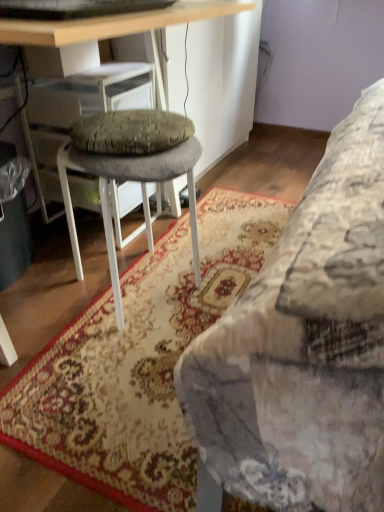
Question: In the image, is floral carpet at lower right positioned in front of or behind gray fabric stool at center?

Choices:
 (A) front
 (B) behind

Answer: (A)

Question: Is floral carpet at lower right spatially inside gray fabric stool at center, or outside of it?

Choices:
 (A) inside
 (B) outside

Answer: (B)

Question: Which object is the closest to the wooden desk at center?

Choices:
 (A) floral carpet at lower right
 (B) gray fabric stool at center

Answer: (B)

Question: Which object is the closest to the wooden desk at center?

Choices:
 (A) gray fabric stool at center
 (B) floral carpet at lower right

Answer: (A)